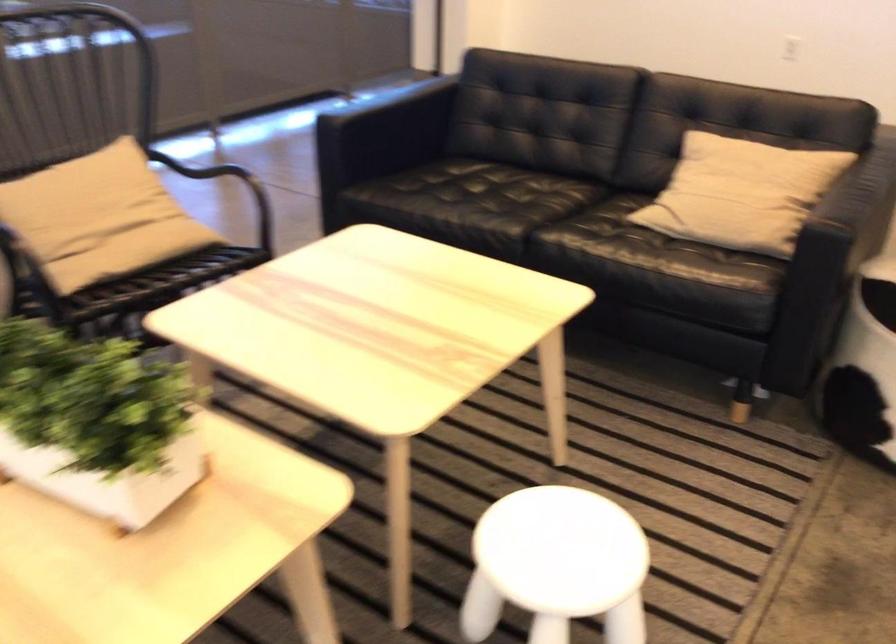
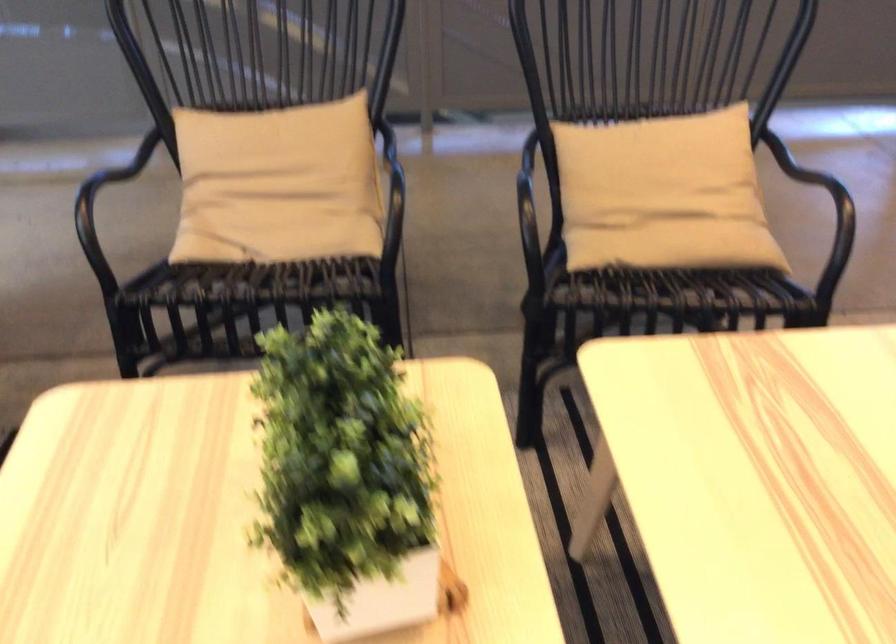
Where in the second image is the point corresponding to [99,225] from the first image?

(662, 194)